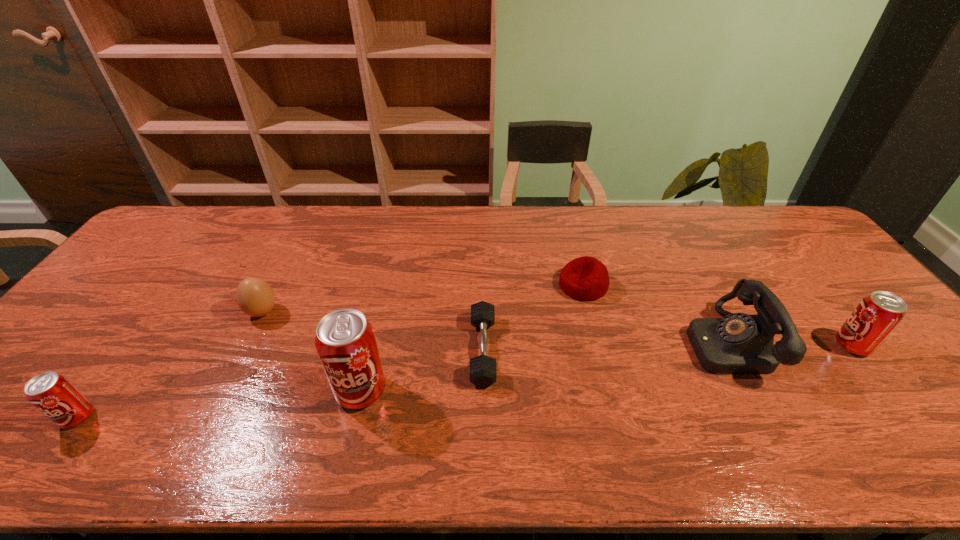
Identify the location of free spot located 0.200m on the dial of the sixth object from left to right. Image resolution: width=960 pixels, height=540 pixels. (612, 343).

This screenshot has width=960, height=540. I want to click on free space located on the dial of the sixth object from left to right, so click(543, 343).

Where is `vacant position located on the dial of the sixth object from left to right`? This screenshot has width=960, height=540. vacant position located on the dial of the sixth object from left to right is located at coordinates (605, 343).

Where is `dumbbell that is at the near edge`? This screenshot has height=540, width=960. dumbbell that is at the near edge is located at coordinates coord(483,372).

The image size is (960, 540). I want to click on telephone that is at the near edge, so click(739, 343).

You are a GUI agent. You are given a task and a screenshot of the screen. Output one action in this format:
    pyautogui.click(x=<x>, y=<y>)
    Task: Click on the object at the right edge
    This screenshot has width=960, height=540.
    Given the screenshot: What is the action you would take?
    pyautogui.click(x=877, y=315)

This screenshot has height=540, width=960. In the image, there is a desktop. In order to click on vacant space at the far edge in this screenshot , I will do `click(579, 219)`.

Locate an element on the screen. vacant region at the near edge of the desktop is located at coordinates (122, 415).

Locate an element on the screen. The height and width of the screenshot is (540, 960). vacant space at the left edge of the desktop is located at coordinates (63, 358).

Locate an element on the screen. This screenshot has width=960, height=540. vacant point at the right edge is located at coordinates (794, 262).